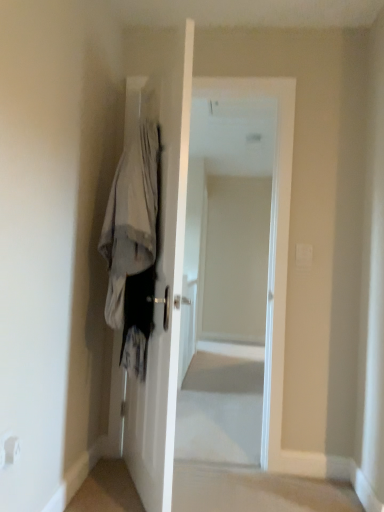
Question: Is white glossy door at center surrounded by white fabric coat at left?

Choices:
 (A) yes
 (B) no

Answer: (B)

Question: Does white fabric coat at left have a lesser height compared to white glossy door at center?

Choices:
 (A) no
 (B) yes

Answer: (B)

Question: Is white fabric coat at left wider than white glossy door at center?

Choices:
 (A) yes
 (B) no

Answer: (A)

Question: Is white fabric coat at left not within white glossy door at center?

Choices:
 (A) no
 (B) yes

Answer: (B)

Question: Is the depth of white fabric coat at left greater than that of white glossy door at center?

Choices:
 (A) no
 (B) yes

Answer: (A)

Question: Would you say white glossy door at center is to the left or to the right of white fabric coat at left in the picture?

Choices:
 (A) right
 (B) left

Answer: (A)

Question: Is white glossy door at center bigger or smaller than white fabric coat at left?

Choices:
 (A) big
 (B) small

Answer: (A)

Question: In the image, is white glossy door at center positioned in front of or behind white fabric coat at left?

Choices:
 (A) front
 (B) behind

Answer: (A)

Question: From the image's perspective, is white glossy door at center positioned above or below white fabric coat at left?

Choices:
 (A) above
 (B) below

Answer: (B)

Question: Is white glossy door at center inside or outside of white glossy door at center?

Choices:
 (A) inside
 (B) outside

Answer: (B)

Question: Is point (150, 428) positioned closer to the camera than point (256, 415)?

Choices:
 (A) farther
 (B) closer

Answer: (B)

Question: Is white glossy door at center to the left or to the right of white glossy door at center in the image?

Choices:
 (A) left
 (B) right

Answer: (A)

Question: Considering the positions of white glossy door at center and white glossy door at center in the image, is white glossy door at center taller or shorter than white glossy door at center?

Choices:
 (A) short
 (B) tall

Answer: (A)

Question: Is white fabric coat at left wider or thinner than white glossy door at center?

Choices:
 (A) thin
 (B) wide

Answer: (B)

Question: Based on their sizes in the image, would you say white fabric coat at left is bigger or smaller than white glossy door at center?

Choices:
 (A) small
 (B) big

Answer: (A)